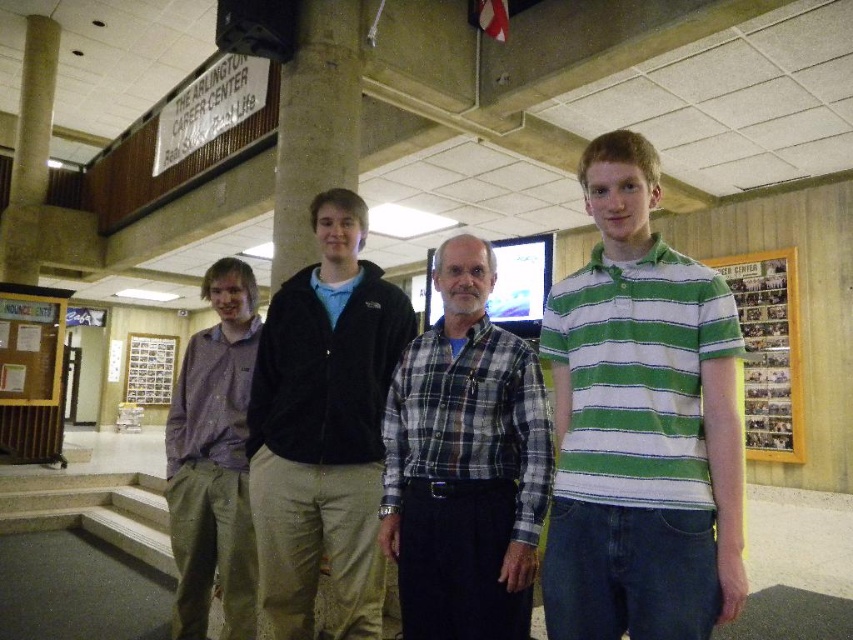
Question: Which is farther from the concrete pillar at center?

Choices:
 (A) velvet black jacket at center
 (B) wooden bulletin board at left

Answer: (B)

Question: Can you confirm if green striped polo shirt at center is positioned to the left of wooden bulletin board at left?

Choices:
 (A) yes
 (B) no

Answer: (B)

Question: Which of these objects is positioned farthest from the purple cotton shirt at left?

Choices:
 (A) concrete pillar at center
 (B) wooden bulletin board at left
 (C) velvet black jacket at center

Answer: (B)

Question: Can you confirm if plaid shirt at center is bigger than wooden bulletin board at left?

Choices:
 (A) no
 (B) yes

Answer: (A)

Question: Is plaid shirt at center above purple cotton shirt at left?

Choices:
 (A) no
 (B) yes

Answer: (B)

Question: Which of the following is the closest to the observer?

Choices:
 (A) velvet black jacket at center
 (B) plaid shirt at center

Answer: (B)